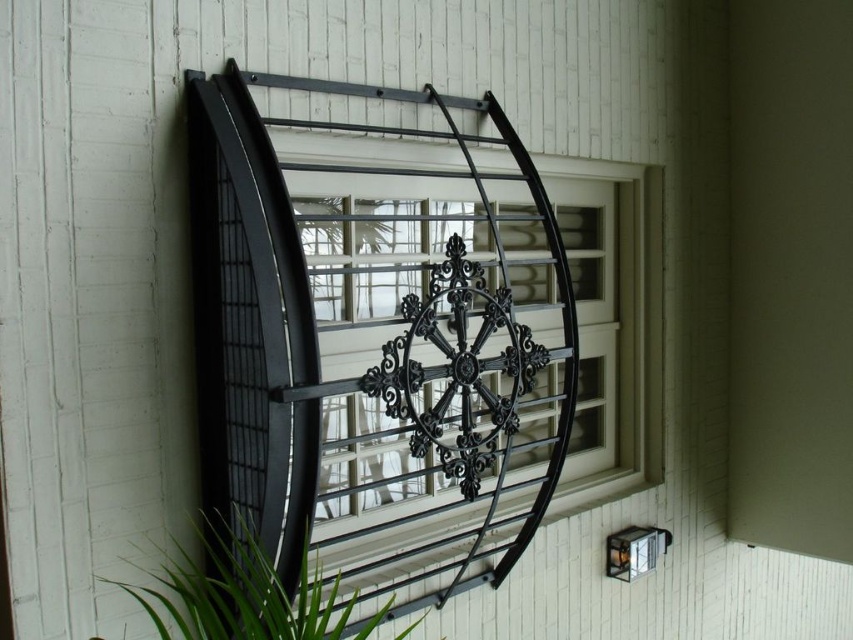
Question: Which object appears closest to the camera in this image?

Choices:
 (A) green leafy plant at lower left
 (B) black metal/iron at upper center

Answer: (A)

Question: Does black metal/iron at upper center have a larger size compared to green leafy plant at lower left?

Choices:
 (A) yes
 (B) no

Answer: (A)

Question: Does black metal/iron at upper center appear under green leafy plant at lower left?

Choices:
 (A) yes
 (B) no

Answer: (B)

Question: Does black metal/iron at upper center have a larger size compared to green leafy plant at lower left?

Choices:
 (A) no
 (B) yes

Answer: (B)

Question: Which of the following is the closest to the observer?

Choices:
 (A) black metal/iron at upper center
 (B) green leafy plant at lower left

Answer: (B)

Question: Among these points, which one is nearest to the camera?

Choices:
 (A) [555, 284]
 (B) [212, 538]

Answer: (B)